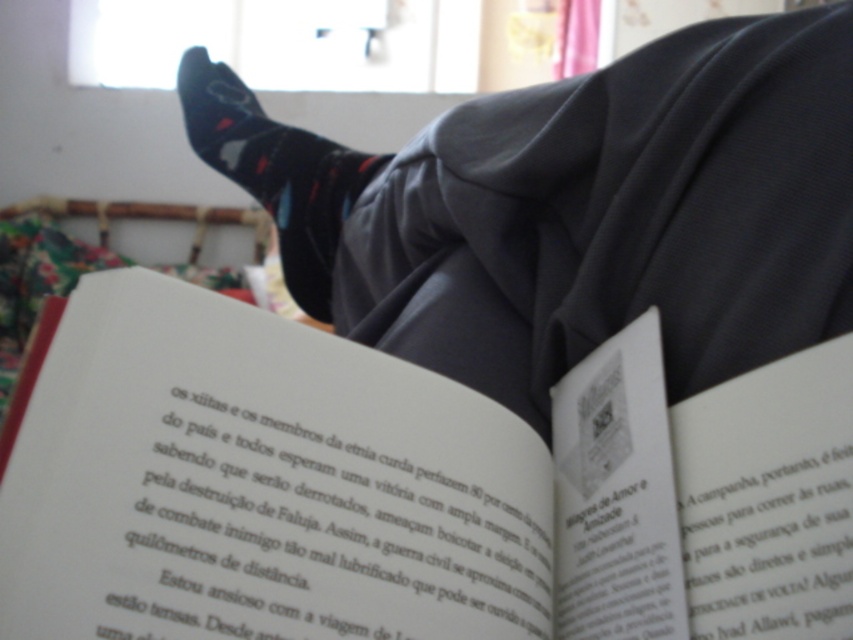
You are an interior designer assessing the layout of a cozy reading nook. You notice the white paper at upper center and the black matte socks at upper center. Which object is taller in the image?

The black matte socks at upper center are taller than the white paper at upper center.

You are a photographer trying to capture the white paper at upper center and the black matte socks at upper center in a single shot. Since the camera can only focus on one object at a time, which object should you focus on to ensure the other remains in the background?

You should focus on the white paper at upper center because it is closer to the viewer, and the black matte socks at upper center will naturally be in the background. This way, the socks will remain in focus if the depth of field allows, or appear blurred as the background depending on the camera settings.

You are standing in the room and want to place a small sticker on the point that is closer to you. Which point should you choose between point (653, 220) and point (195, 74)?

Point (653, 220) is closer to the viewer than point (195, 74), so you should choose point (653, 220) to place the sticker.